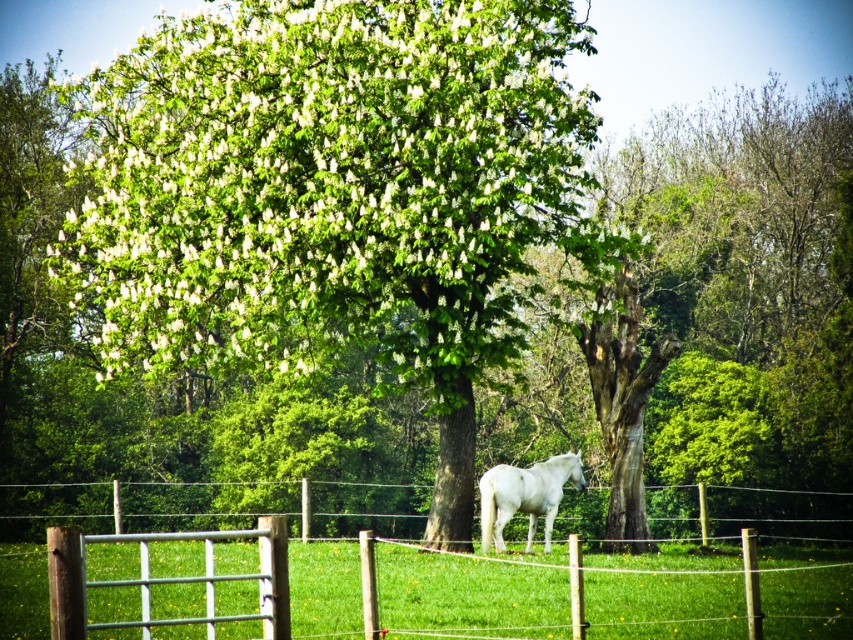
Is the position of green leafy tree at center more distant than that of white glossy horse at center?

No, it is in front of white glossy horse at center.

Does point (368, 86) come farther from viewer compared to point (563, 474)?

No, it is not.

Locate an element on the screen. The height and width of the screenshot is (640, 853). green leafy tree at center is located at coordinates (338, 193).

Who is positioned more to the left, green leafy tree at center or metal wire fence at center?

green leafy tree at center is more to the left.

Can you confirm if green leafy tree at center is positioned to the left of metal wire fence at center?

Indeed, green leafy tree at center is positioned on the left side of metal wire fence at center.

Is point (97, 296) farther from viewer compared to point (846, 550)?

No, it is in front of (846, 550).

Locate an element on the screen. green leafy tree at center is located at coordinates (338, 193).

Does point (135, 570) come farther from viewer compared to point (521, 506)?

That is False.

In the scene shown: Can you confirm if metal wire fence at center is bigger than white glossy horse at center?

Indeed, metal wire fence at center has a larger size compared to white glossy horse at center.

What do you see at coordinates (473, 593) in the screenshot?
I see `metal wire fence at center` at bounding box center [473, 593].

Where is `metal wire fence at center`? The image size is (853, 640). metal wire fence at center is located at coordinates (473, 593).